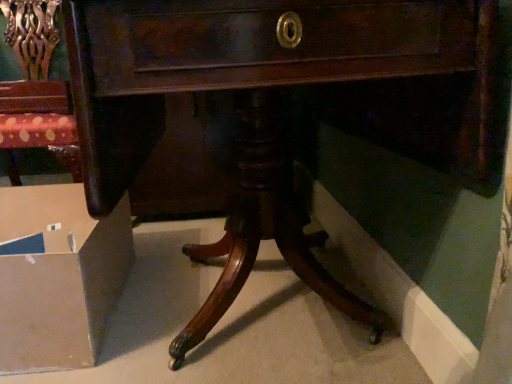
Question: Considering the relative sizes of cardboard box at lower left and polished wood chair at upper left in the image provided, is cardboard box at lower left taller than polished wood chair at upper left?

Choices:
 (A) yes
 (B) no

Answer: (B)

Question: Is cardboard box at lower left wider than polished wood chair at upper left?

Choices:
 (A) no
 (B) yes

Answer: (B)

Question: From a real-world perspective, is cardboard box at lower left located beneath polished wood chair at upper left?

Choices:
 (A) no
 (B) yes

Answer: (B)

Question: From a real-world perspective, is cardboard box at lower left on top of polished wood chair at upper left?

Choices:
 (A) no
 (B) yes

Answer: (A)

Question: Is cardboard box at lower left positioned beyond the bounds of polished wood chair at upper left?

Choices:
 (A) no
 (B) yes

Answer: (B)

Question: Is cardboard box at lower left at the left side of polished wood chair at upper left?

Choices:
 (A) yes
 (B) no

Answer: (B)

Question: Considering the relative sizes of polished wood chair at upper left and cardboard box at lower left in the image provided, is polished wood chair at upper left smaller than cardboard box at lower left?

Choices:
 (A) no
 (B) yes

Answer: (A)

Question: From the image's perspective, would you say polished wood chair at upper left is positioned over cardboard box at lower left?

Choices:
 (A) yes
 (B) no

Answer: (A)

Question: Does polished wood chair at upper left appear on the left side of cardboard box at lower left?

Choices:
 (A) yes
 (B) no

Answer: (A)

Question: Considering the relative sizes of polished wood chair at upper left and cardboard box at lower left in the image provided, is polished wood chair at upper left wider than cardboard box at lower left?

Choices:
 (A) no
 (B) yes

Answer: (A)

Question: Is polished wood chair at upper left positioned before cardboard box at lower left?

Choices:
 (A) yes
 (B) no

Answer: (B)

Question: From a real-world perspective, is polished wood chair at upper left physically below cardboard box at lower left?

Choices:
 (A) no
 (B) yes

Answer: (A)

Question: Is polished wood chair at upper left taller or shorter than cardboard box at lower left?

Choices:
 (A) short
 (B) tall

Answer: (B)